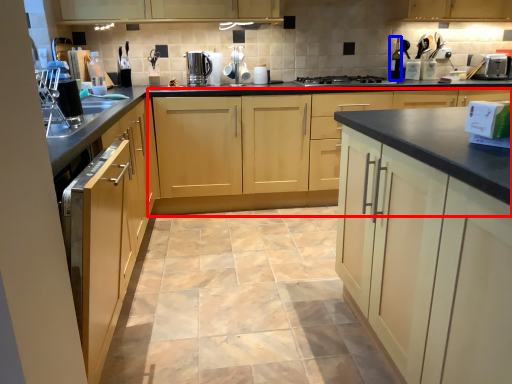
Question: Which point is further to the camera, cabinetry (highlighted by a red box) or bottle (highlighted by a blue box)?

Choices:
 (A) cabinetry
 (B) bottle

Answer: (B)